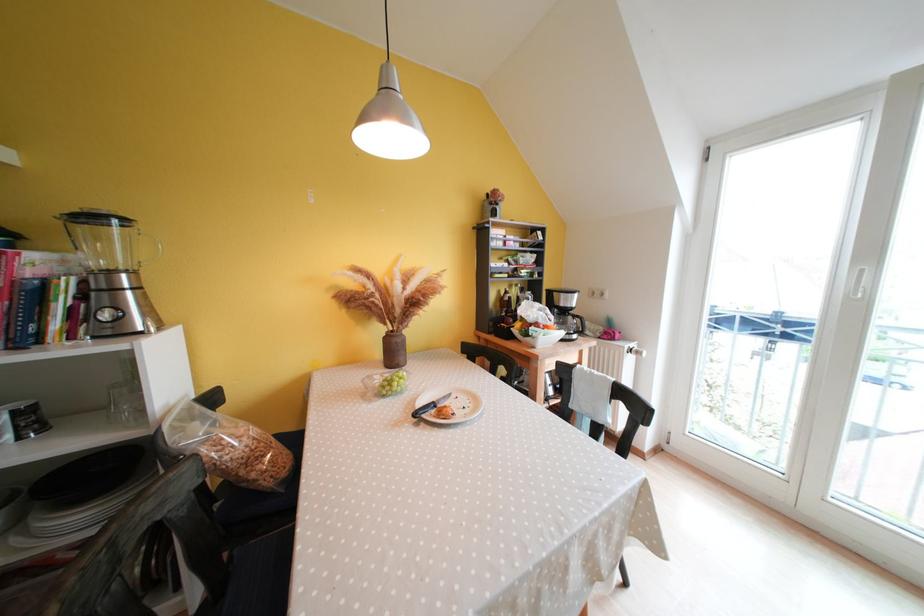
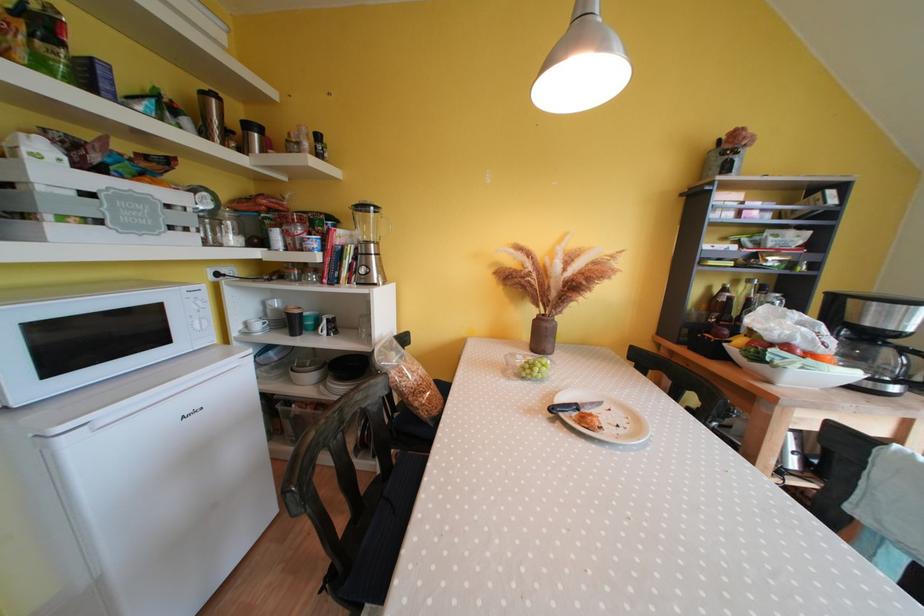
Where in the second image is the point corresponding to point (129, 280) from the first image?

(379, 249)